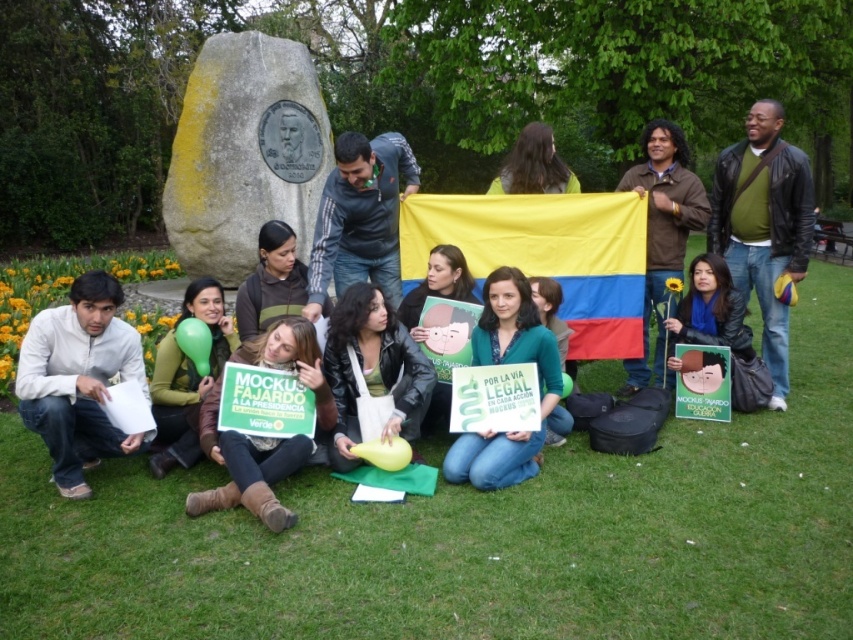
Can you confirm if yellow fabric flag at center is thinner than leather jacket at center?

No, yellow fabric flag at center is not thinner than leather jacket at center.

Who is higher up, yellow fabric flag at center or leather jacket at center?

yellow fabric flag at center is higher up.

At what (x,y) coordinates should I click in order to perform the action: click on yellow fabric flag at center. Please return your answer as a coordinate pair (x, y). The image size is (853, 640). Looking at the image, I should click on (544, 253).

Is point (109, 611) closer to viewer compared to point (268, 497)?

Yes.

Is green grass at lower center wider than green fabric sign at lower center?

Yes.

Is point (399, 532) positioned in front of point (260, 506)?

That is True.

Where is `green grass at lower center`? The height and width of the screenshot is (640, 853). green grass at lower center is located at coordinates (473, 536).

The image size is (853, 640). I want to click on yellow fabric flag at center, so click(x=544, y=253).

Between yellow fabric flag at center and green matte sign at center, which one appears on the right side from the viewer's perspective?

From the viewer's perspective, yellow fabric flag at center appears more on the right side.

Where is `yellow fabric flag at center`? This screenshot has height=640, width=853. yellow fabric flag at center is located at coordinates (544, 253).